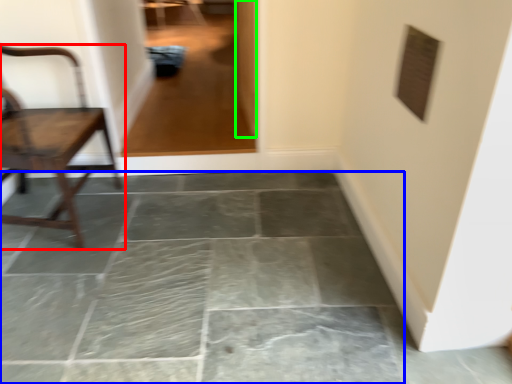
Question: Which object is the closest to the chair (highlighted by a red box)? Choose among these: concrete (highlighted by a blue box) or glass door (highlighted by a green box).

Choices:
 (A) concrete
 (B) glass door

Answer: (A)